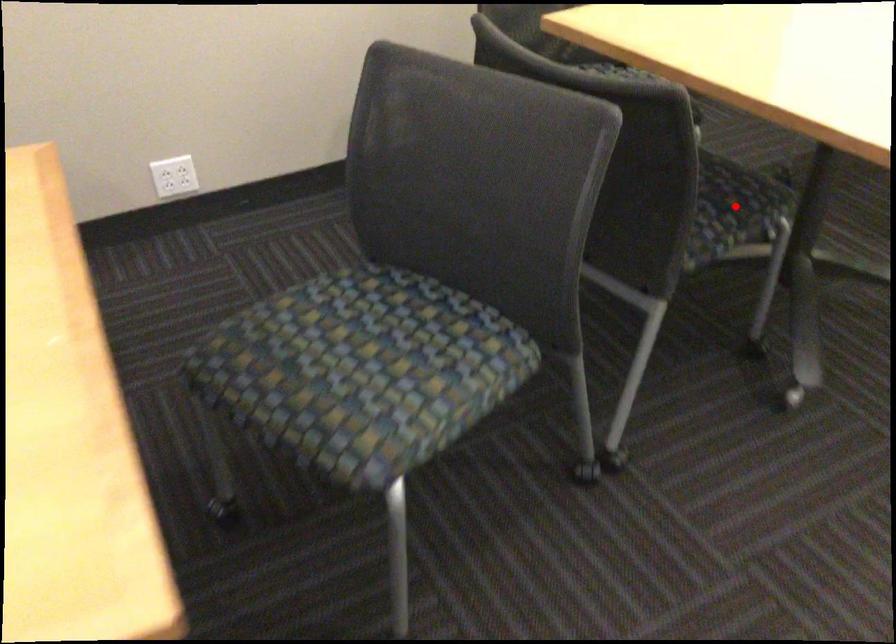
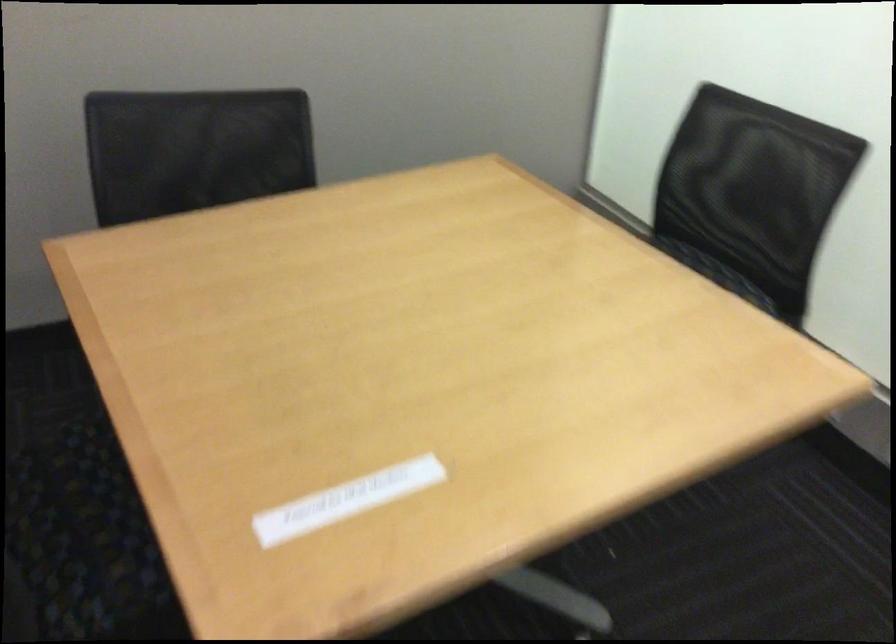
Question: I am providing you with two images of the same scene from different viewpoints. A red point is marked on the first image. Is the red point's position out of view in image 2?

Choices:
 (A) Yes
 (B) No

Answer: (A)